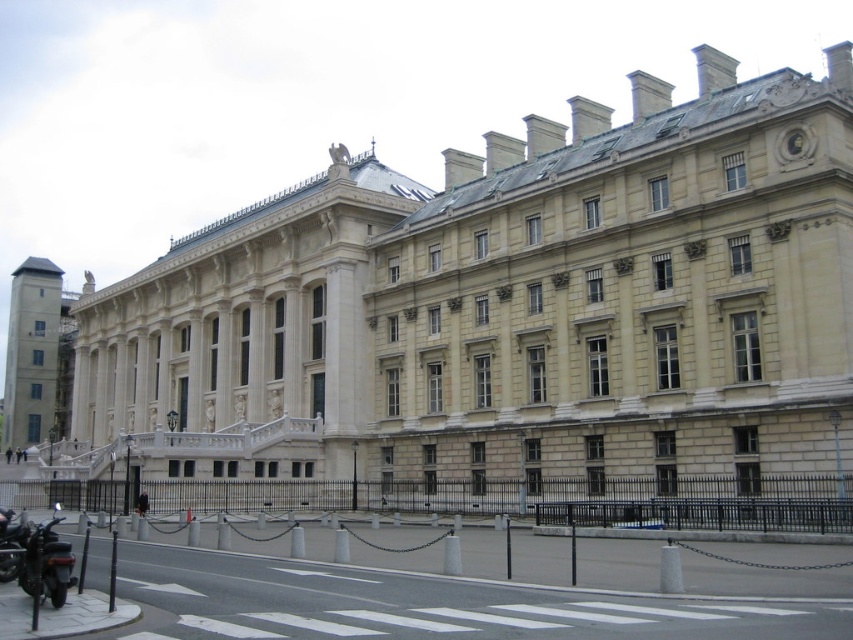
Question: Is beige stone palace at center positioned before shiny black motorbike at lower left?

Choices:
 (A) yes
 (B) no

Answer: (B)

Question: Can you confirm if beige stone palace at center is positioned below shiny black motorbike at lower left?

Choices:
 (A) yes
 (B) no

Answer: (B)

Question: Can you confirm if beige stone palace at center is thinner than shiny black motorbike at lower left?

Choices:
 (A) no
 (B) yes

Answer: (A)

Question: Which object appears farthest from the camera in this image?

Choices:
 (A) beige stone palace at center
 (B) shiny black motorbike at lower left

Answer: (A)

Question: Which of the following is the closest to the observer?

Choices:
 (A) (28, 586)
 (B) (647, 109)

Answer: (A)